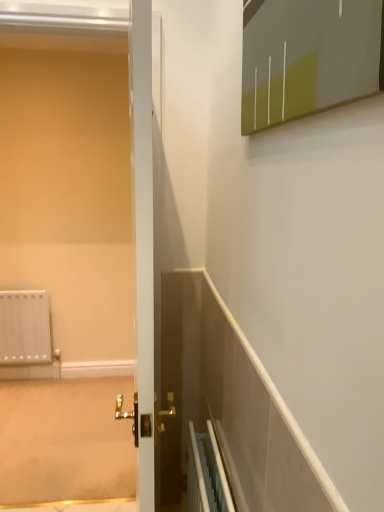
Question: Is matte white screen door at left a part of matte gray medicine cabinet at upper right?

Choices:
 (A) no
 (B) yes

Answer: (A)

Question: Is matte gray medicine cabinet at upper right thinner than matte white screen door at left?

Choices:
 (A) no
 (B) yes

Answer: (B)

Question: Does matte gray medicine cabinet at upper right have a larger size compared to matte white screen door at left?

Choices:
 (A) no
 (B) yes

Answer: (A)

Question: Is matte gray medicine cabinet at upper right aimed at matte white screen door at left?

Choices:
 (A) yes
 (B) no

Answer: (B)

Question: Is matte gray medicine cabinet at upper right in front of matte white screen door at left?

Choices:
 (A) yes
 (B) no

Answer: (A)

Question: Is matte white screen door at left at the back of matte gray medicine cabinet at upper right?

Choices:
 (A) yes
 (B) no

Answer: (B)

Question: Would you consider matte white screen door at left to be distant from matte gray medicine cabinet at upper right?

Choices:
 (A) no
 (B) yes

Answer: (B)

Question: Is matte white screen door at left taller than matte gray medicine cabinet at upper right?

Choices:
 (A) no
 (B) yes

Answer: (B)

Question: Does matte white screen door at left come behind matte gray medicine cabinet at upper right?

Choices:
 (A) yes
 (B) no

Answer: (A)

Question: Is matte white screen door at left smaller than matte gray medicine cabinet at upper right?

Choices:
 (A) yes
 (B) no

Answer: (B)

Question: Would you say matte white screen door at left contains matte gray medicine cabinet at upper right?

Choices:
 (A) no
 (B) yes

Answer: (A)

Question: Considering the relative positions of matte white screen door at left and matte gray medicine cabinet at upper right in the image provided, is matte white screen door at left to the left of matte gray medicine cabinet at upper right from the viewer's perspective?

Choices:
 (A) yes
 (B) no

Answer: (A)

Question: Considering the positions of matte gray medicine cabinet at upper right and matte white screen door at left in the image, is matte gray medicine cabinet at upper right taller or shorter than matte white screen door at left?

Choices:
 (A) short
 (B) tall

Answer: (A)